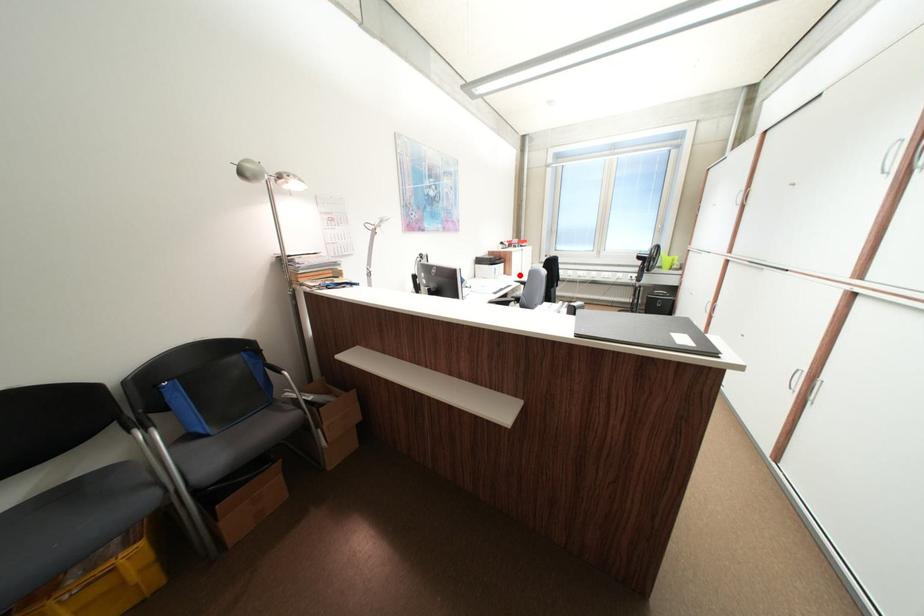
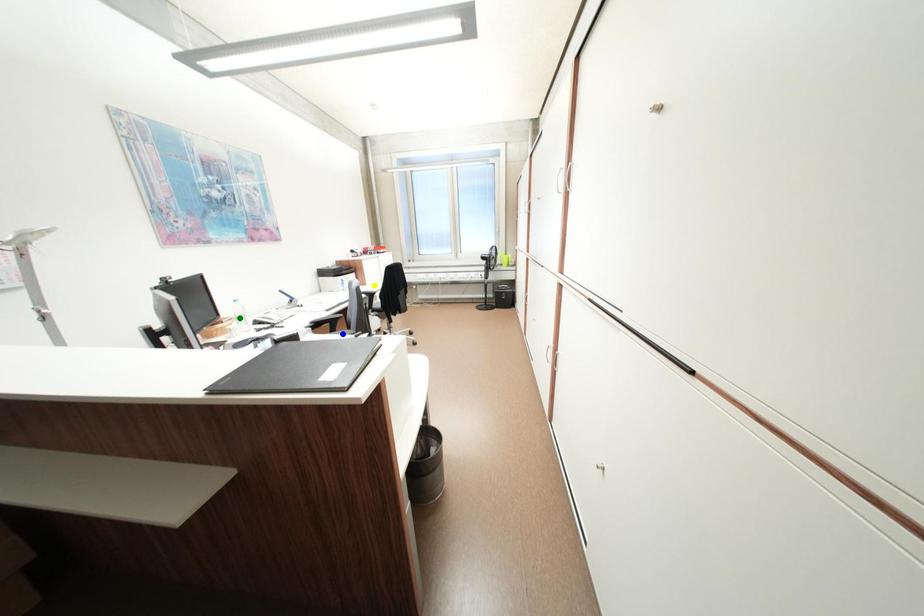
Question: I am providing you with two images of the same scene from different viewpoints. A red point is marked on the first image. You are given multiple points on the second image. Can you choose the point in image 2 that corresponds to the point in image 1?

Choices:
 (A) green point
 (B) blue point
 (C) yellow point

Answer: (C)